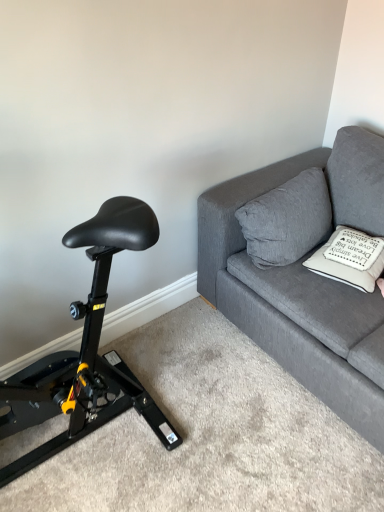
Question: Is black leather saddle at left outside textured gray couch at upper right?

Choices:
 (A) no
 (B) yes

Answer: (B)

Question: Does black leather saddle at left have a smaller size compared to textured gray couch at upper right?

Choices:
 (A) no
 (B) yes

Answer: (B)

Question: Considering the relative sizes of black leather saddle at left and textured gray couch at upper right in the image provided, is black leather saddle at left thinner than textured gray couch at upper right?

Choices:
 (A) no
 (B) yes

Answer: (B)

Question: Considering the relative positions of black leather saddle at left and textured gray couch at upper right in the image provided, is black leather saddle at left to the right of textured gray couch at upper right from the viewer's perspective?

Choices:
 (A) yes
 (B) no

Answer: (B)

Question: Is black leather saddle at left taller than textured gray couch at upper right?

Choices:
 (A) no
 (B) yes

Answer: (B)

Question: Is the position of black leather saddle at left more distant than that of textured gray couch at upper right?

Choices:
 (A) yes
 (B) no

Answer: (B)

Question: From the image's perspective, would you say white soft cushion at upper right, which is counted as the second pillow, starting from the left, is shown under textured gray couch at upper right?

Choices:
 (A) yes
 (B) no

Answer: (A)

Question: Can you confirm if white soft cushion at upper right, marked as the first pillow in a right-to-left arrangement, is bigger than textured gray couch at upper right?

Choices:
 (A) yes
 (B) no

Answer: (B)

Question: Is white soft cushion at upper right, marked as the first pillow in a right-to-left arrangement, in front of textured gray couch at upper right?

Choices:
 (A) yes
 (B) no

Answer: (B)

Question: Does white soft cushion at upper right, marked as the first pillow in a right-to-left arrangement, contain textured gray couch at upper right?

Choices:
 (A) yes
 (B) no

Answer: (B)

Question: Is white soft cushion at upper right, which is counted as the second pillow, starting from the left, at the right side of textured gray couch at upper right?

Choices:
 (A) yes
 (B) no

Answer: (B)

Question: Can you confirm if white soft cushion at upper right, which is counted as the second pillow, starting from the left, is taller than textured gray couch at upper right?

Choices:
 (A) yes
 (B) no

Answer: (B)

Question: Can you confirm if gray fabric pillow at upper right, the second pillow positioned from the right, is positioned to the right of white soft cushion at upper right, marked as the first pillow in a right-to-left arrangement?

Choices:
 (A) no
 (B) yes

Answer: (A)